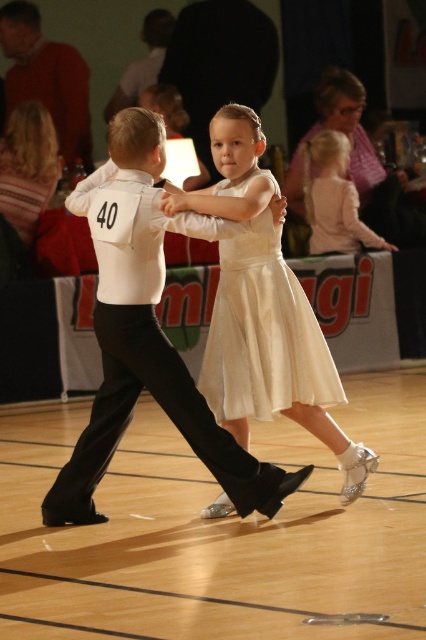
Is white satin dress at center behind red sweater at upper left?

No.

Is point (221, 182) less distant than point (55, 67)?

Yes, it is in front of point (55, 67).

Locate an element on the screen. Image resolution: width=426 pixels, height=640 pixels. white satin dress at center is located at coordinates (273, 355).

Image resolution: width=426 pixels, height=640 pixels. In order to click on white satin dress at center in this screenshot , I will do `click(273, 355)`.

Between point (241, 288) and point (386, 248), which one is positioned in front?

Point (241, 288) is in front.

Identify the location of white satin dress at center. The height and width of the screenshot is (640, 426). (273, 355).

Is matte white shirt at center to the right of light pink fabric dress at upper right from the viewer's perspective?

Incorrect, matte white shirt at center is not on the right side of light pink fabric dress at upper right.

Based on the photo, between matte white shirt at center and light pink fabric dress at upper right, which one appears on the left side from the viewer's perspective?

From the viewer's perspective, matte white shirt at center appears more on the left side.

Which is in front, point (268, 516) or point (307, 147)?

Positioned in front is point (268, 516).

Locate an element on the screen. Image resolution: width=426 pixels, height=640 pixels. matte white shirt at center is located at coordinates tap(149, 349).